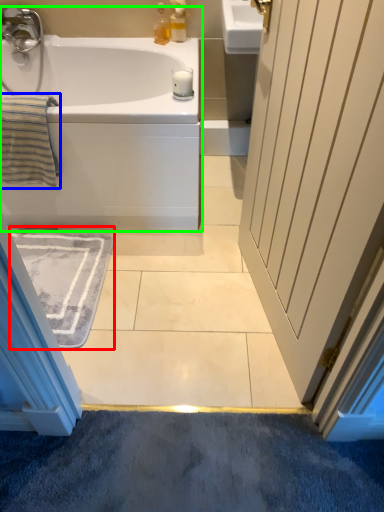
Question: Which object is positioned farthest from bath mat (highlighted by a red box)? Select from bath towel (highlighted by a blue box) and bathtub (highlighted by a green box).

Choices:
 (A) bath towel
 (B) bathtub

Answer: (A)